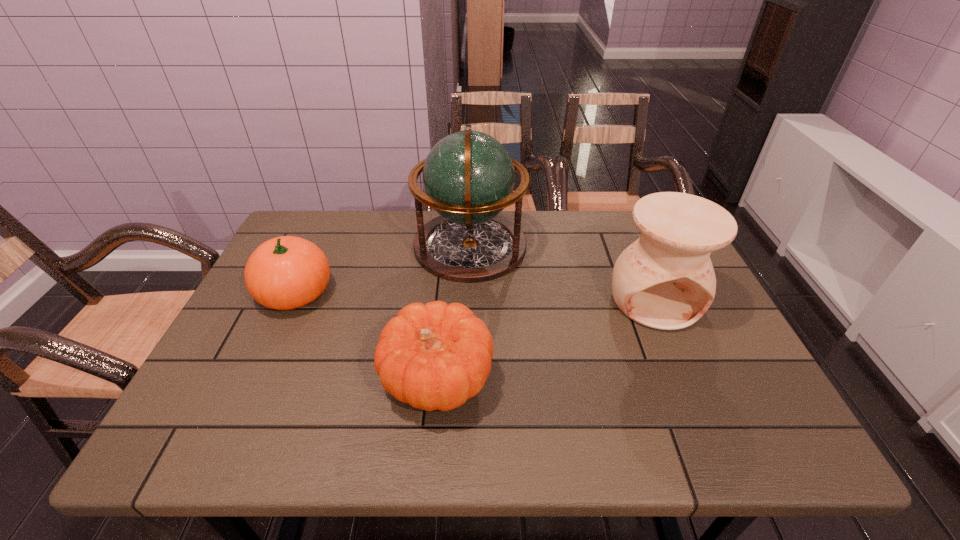
You are a GUI agent. You are given a task and a screenshot of the screen. Output one action in this format:
    pyautogui.click(x=<x>, y=<y>)
    Task: Click on the tallest object
    The image size is (960, 540).
    Given the screenshot: What is the action you would take?
    pyautogui.click(x=468, y=177)

Where is `the second tallest object`? The image size is (960, 540). the second tallest object is located at coordinates (665, 280).

This screenshot has width=960, height=540. I want to click on the rightmost object, so 665,280.

This screenshot has width=960, height=540. I want to click on the leftmost object, so click(287, 272).

I want to click on the farther pumpkin, so click(287, 272).

Image resolution: width=960 pixels, height=540 pixels. Identify the location of the right pumpkin. (435, 356).

Find the location of a particular element. This screenshot has width=960, height=540. the nearest object is located at coordinates (435, 356).

Locate an element on the screen. The width and height of the screenshot is (960, 540). free location located 0.300m on the front-facing side of the globe is located at coordinates (627, 246).

Where is `vacant region located 0.170m at the open side of the rightmost object`? Image resolution: width=960 pixels, height=540 pixels. vacant region located 0.170m at the open side of the rightmost object is located at coordinates (695, 394).

Find the location of a particular element. The image size is (960, 540). vacant space situated 0.270m on the front of the leftmost object is located at coordinates (237, 419).